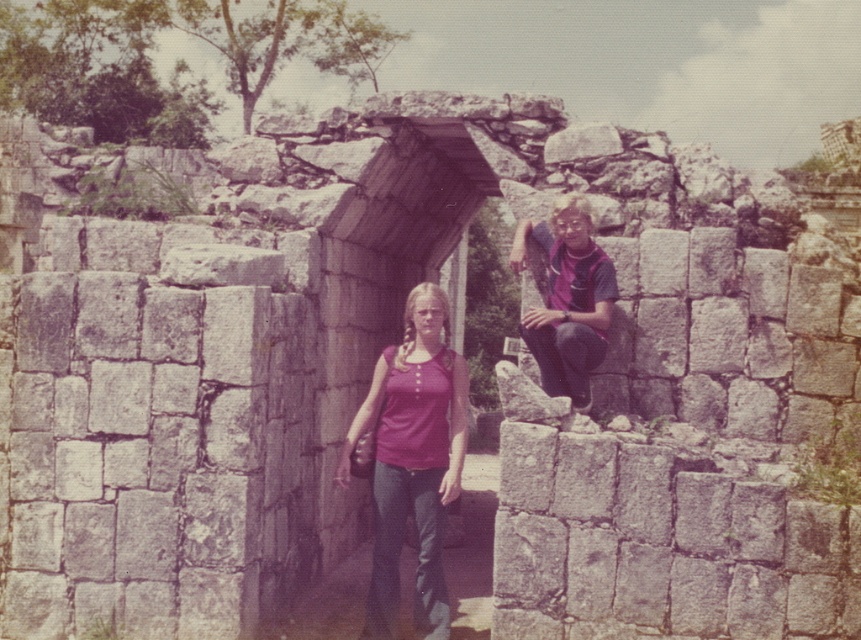
Can you confirm if matte purple shirt at center is thinner than purple fabric shirt at upper right?

Yes.

Can you confirm if matte purple shirt at center is bigger than purple fabric shirt at upper right?

No, matte purple shirt at center is not bigger than purple fabric shirt at upper right.

Does point (419, 618) come closer to viewer compared to point (542, 385)?

Yes, it is.

You are a GUI agent. You are given a task and a screenshot of the screen. Output one action in this format:
    pyautogui.click(x=<x>, y=<y>)
    Task: Click on the matte purple shirt at center
    
    Given the screenshot: What is the action you would take?
    pyautogui.click(x=412, y=460)